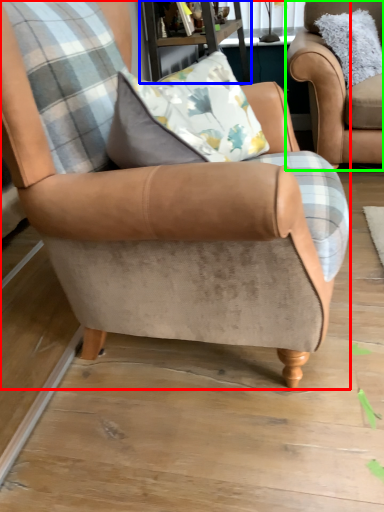
Question: Based on their relative distances, which object is nearer to chair (highlighted by a red box)? Choose from table (highlighted by a blue box) and chair (highlighted by a green box).

Choices:
 (A) table
 (B) chair

Answer: (A)